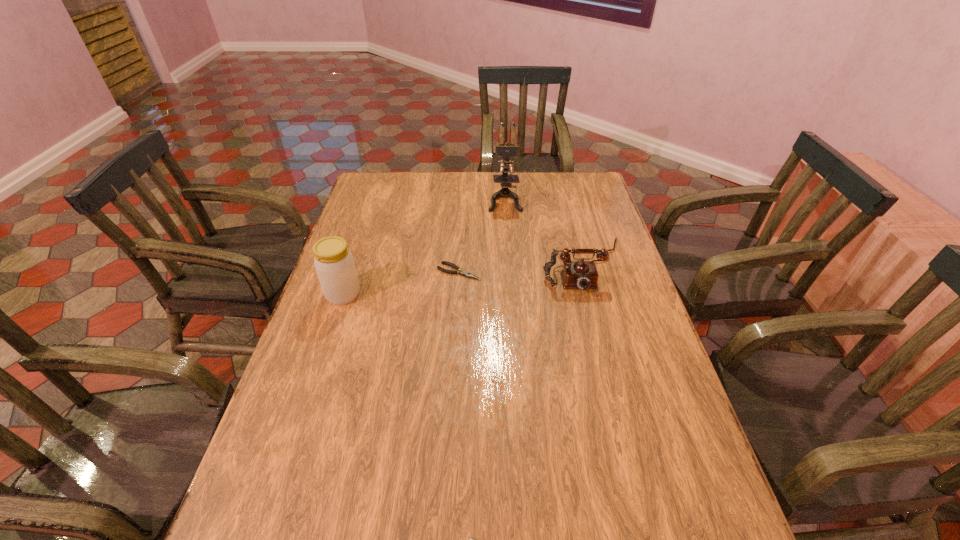
The image size is (960, 540). What are the coordinates of `vacant space located 0.360m on the back of the farther pliers` in the screenshot? It's located at (463, 202).

Locate an element on the screen. The height and width of the screenshot is (540, 960). object that is at the far edge is located at coordinates (504, 149).

Image resolution: width=960 pixels, height=540 pixels. I want to click on object that is positioned at the left edge, so click(334, 263).

Where is `object at the right edge`? The width and height of the screenshot is (960, 540). object at the right edge is located at coordinates (579, 274).

I want to click on vacant region at the far edge of the desktop, so click(452, 183).

The height and width of the screenshot is (540, 960). What are the coordinates of `vacant space at the left edge` in the screenshot? It's located at (388, 234).

The image size is (960, 540). I want to click on vacant space at the right edge of the desktop, so click(648, 437).

Where is `vacant space that is in between the telephone and the farther pliers`? The height and width of the screenshot is (540, 960). vacant space that is in between the telephone and the farther pliers is located at coordinates (521, 268).

This screenshot has width=960, height=540. In order to click on vacant area between the farther pliers and the telephone in this screenshot , I will do `click(521, 268)`.

Locate an element on the screen. free space between the farthest object and the fourth shortest object is located at coordinates (424, 247).